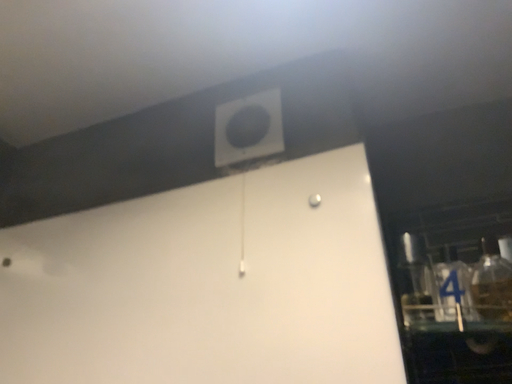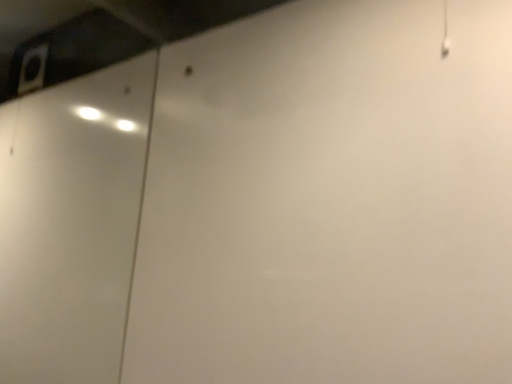
Question: How did the camera likely rotate when shooting the video?

Choices:
 (A) rotated downward
 (B) rotated upward

Answer: (A)